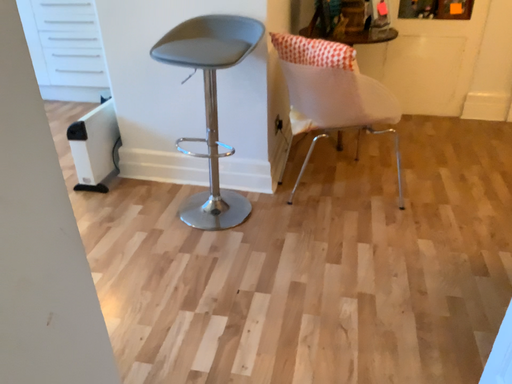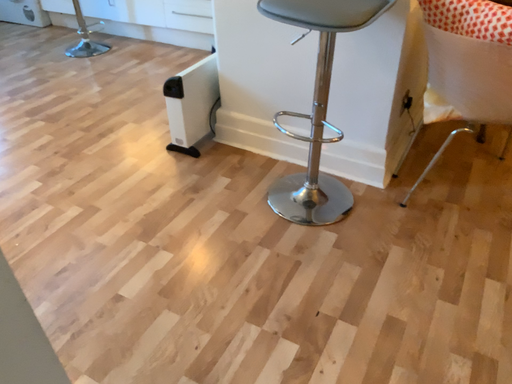
Question: How did the camera likely rotate when shooting the video?

Choices:
 (A) rotated right
 (B) rotated left

Answer: (B)